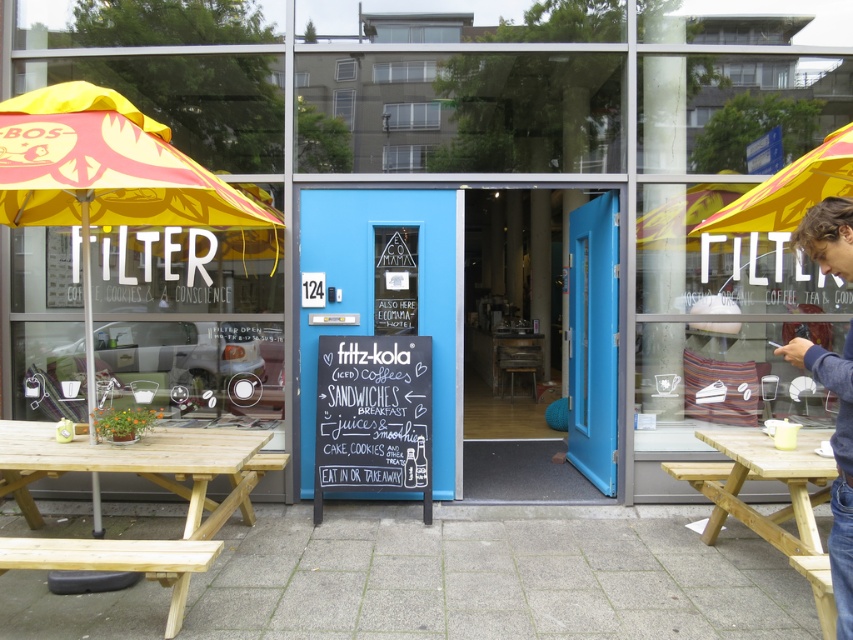
Does natural wood picnic table at right appear over brown hair at right?

No, natural wood picnic table at right is not above brown hair at right.

This screenshot has width=853, height=640. Describe the element at coordinates (776, 509) in the screenshot. I see `natural wood picnic table at right` at that location.

Where is `natural wood picnic table at right`? natural wood picnic table at right is located at coordinates (776, 509).

Between natural wood picnic table at lower left and natural wood picnic table at right, which one appears on the left side from the viewer's perspective?

natural wood picnic table at lower left

Between natural wood picnic table at lower left and natural wood picnic table at right, which one appears on the right side from the viewer's perspective?

From the viewer's perspective, natural wood picnic table at right appears more on the right side.

Describe the element at coordinates (141, 476) in the screenshot. I see `natural wood picnic table at lower left` at that location.

This screenshot has width=853, height=640. Identify the location of natural wood picnic table at lower left. (141, 476).

How much distance is there between yellow fabric umbrella at left and natural wood picnic table at lower left?

yellow fabric umbrella at left and natural wood picnic table at lower left are 3.46 feet apart from each other.

Which is in front, point (253, 205) or point (219, 547)?

Point (219, 547) is more forward.

Locate an element on the screen. This screenshot has width=853, height=640. yellow fabric umbrella at left is located at coordinates (103, 177).